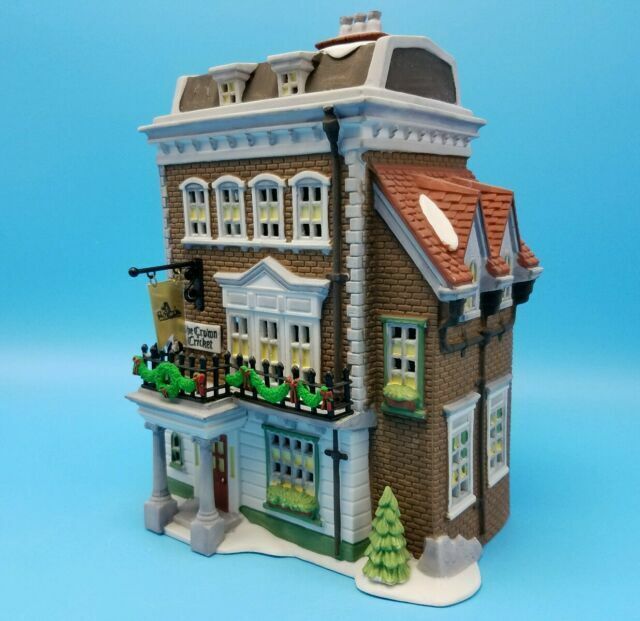
Where is `window flower planters`? window flower planters is located at coordinates [394, 394], [298, 499].